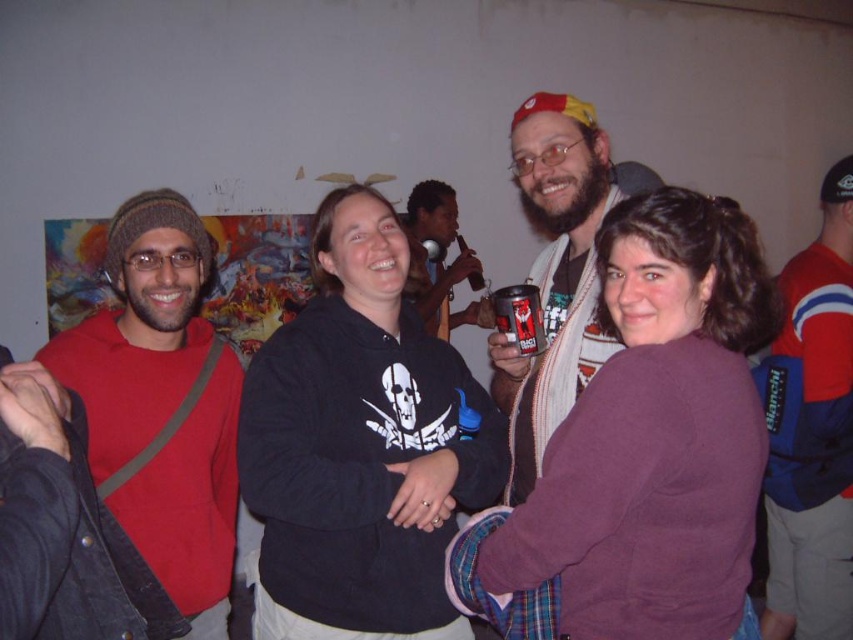
Question: Which object is the farthest from the metallic can at center?

Choices:
 (A) matte black microphone at center
 (B) red and blue jacket at right

Answer: (A)

Question: Is matte red hoodie at left positioned before red and blue jacket at right?

Choices:
 (A) no
 (B) yes

Answer: (B)

Question: Can you confirm if matte red hoodie at left is positioned to the left of red and blue jacket at right?

Choices:
 (A) no
 (B) yes

Answer: (B)

Question: Considering the relative positions of red and blue jacket at right and beige scarf at center in the image provided, where is red and blue jacket at right located with respect to beige scarf at center?

Choices:
 (A) left
 (B) right

Answer: (B)

Question: Which object appears closest to the camera in this image?

Choices:
 (A) metallic can at center
 (B) matte red hoodie at left
 (C) red and blue jacket at right

Answer: (B)

Question: Which point appears farthest from the camera in this image?

Choices:
 (A) (199, 417)
 (B) (799, 353)
 (C) (573, 339)
 (D) (416, 186)

Answer: (D)